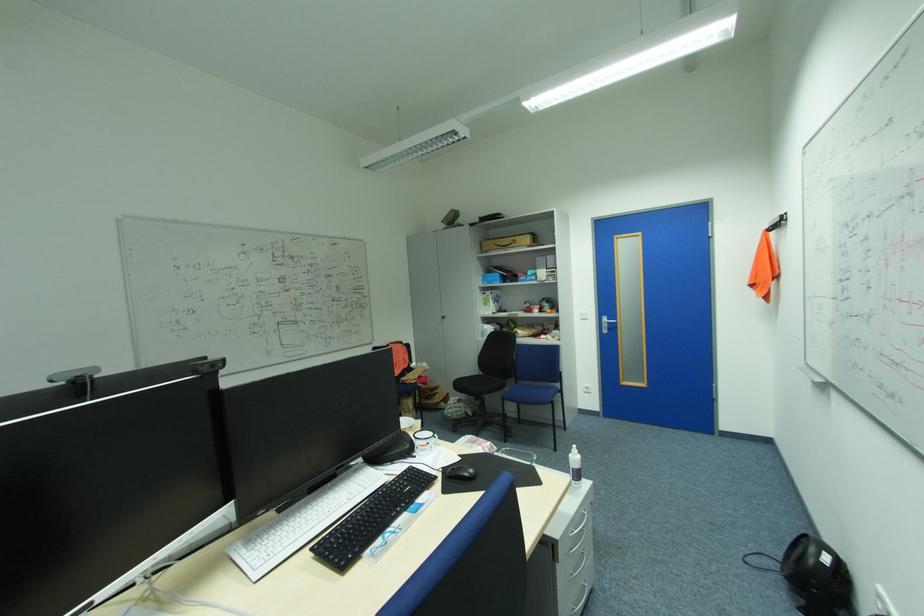
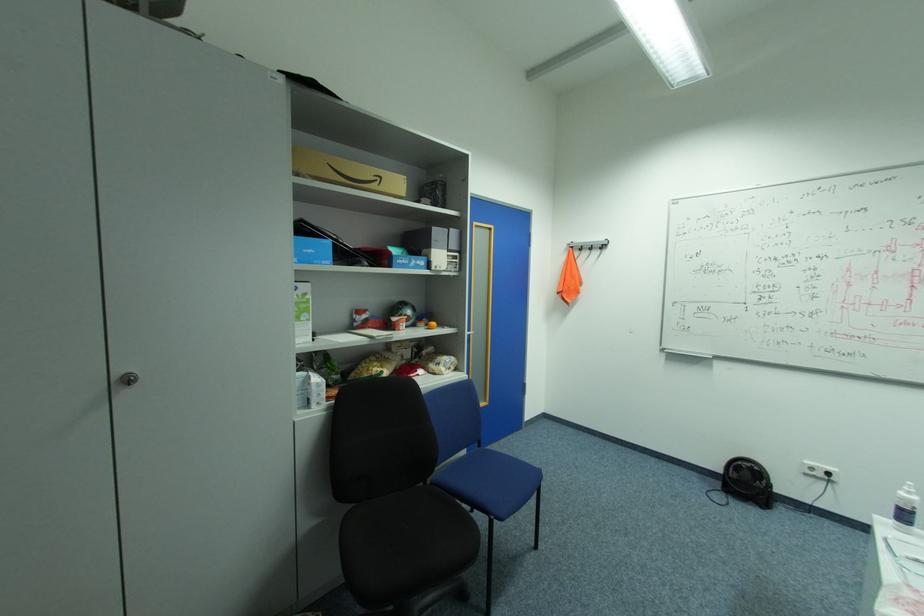
The point at [503,283] is marked in the first image. Where is the corresponding point in the second image?

(331, 262)